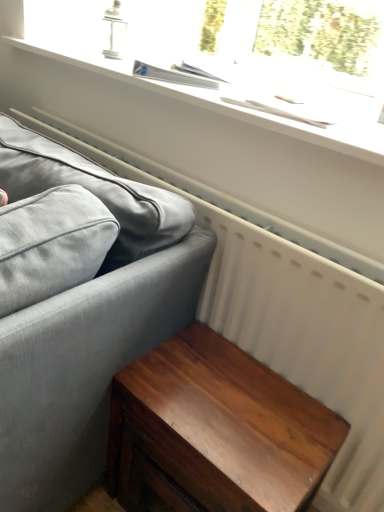
Question: Considering the relative sizes of white matte window sill at upper center and shiny brown wood table at lower right in the image provided, is white matte window sill at upper center smaller than shiny brown wood table at lower right?

Choices:
 (A) no
 (B) yes

Answer: (B)

Question: Would you say shiny brown wood table at lower right is part of white matte window sill at upper center's contents?

Choices:
 (A) yes
 (B) no

Answer: (B)

Question: Would you say white matte window sill at upper center is a long distance from shiny brown wood table at lower right?

Choices:
 (A) yes
 (B) no

Answer: (B)

Question: From the image's perspective, is white matte window sill at upper center on top of shiny brown wood table at lower right?

Choices:
 (A) no
 (B) yes

Answer: (B)

Question: From a real-world perspective, is white matte window sill at upper center located beneath shiny brown wood table at lower right?

Choices:
 (A) no
 (B) yes

Answer: (A)

Question: Does point (264, 472) appear closer or farther from the camera than point (132, 294)?

Choices:
 (A) closer
 (B) farther

Answer: (A)

Question: Would you say shiny brown wood table at lower right is inside or outside matte gray fabric couch at left?

Choices:
 (A) outside
 (B) inside

Answer: (A)

Question: From the image's perspective, is shiny brown wood table at lower right located above or below matte gray fabric couch at left?

Choices:
 (A) above
 (B) below

Answer: (B)

Question: From a real-world perspective, relative to matte gray fabric couch at left, is shiny brown wood table at lower right vertically above or below?

Choices:
 (A) above
 (B) below

Answer: (B)

Question: From their relative heights in the image, would you say shiny brown wood table at lower right is taller or shorter than white matte window sill at upper center?

Choices:
 (A) short
 (B) tall

Answer: (B)

Question: In the image, is shiny brown wood table at lower right positioned in front of or behind white matte window sill at upper center?

Choices:
 (A) front
 (B) behind

Answer: (A)

Question: Considering the positions of shiny brown wood table at lower right and white matte window sill at upper center in the image, is shiny brown wood table at lower right wider or thinner than white matte window sill at upper center?

Choices:
 (A) wide
 (B) thin

Answer: (B)

Question: From the image's perspective, is shiny brown wood table at lower right located above or below white matte window sill at upper center?

Choices:
 (A) below
 (B) above

Answer: (A)

Question: Considering the positions of point (0, 388) and point (173, 372), is point (0, 388) closer or farther from the camera than point (173, 372)?

Choices:
 (A) closer
 (B) farther

Answer: (A)

Question: Is matte gray fabric couch at left situated inside shiny brown wood table at lower right or outside?

Choices:
 (A) outside
 (B) inside

Answer: (A)